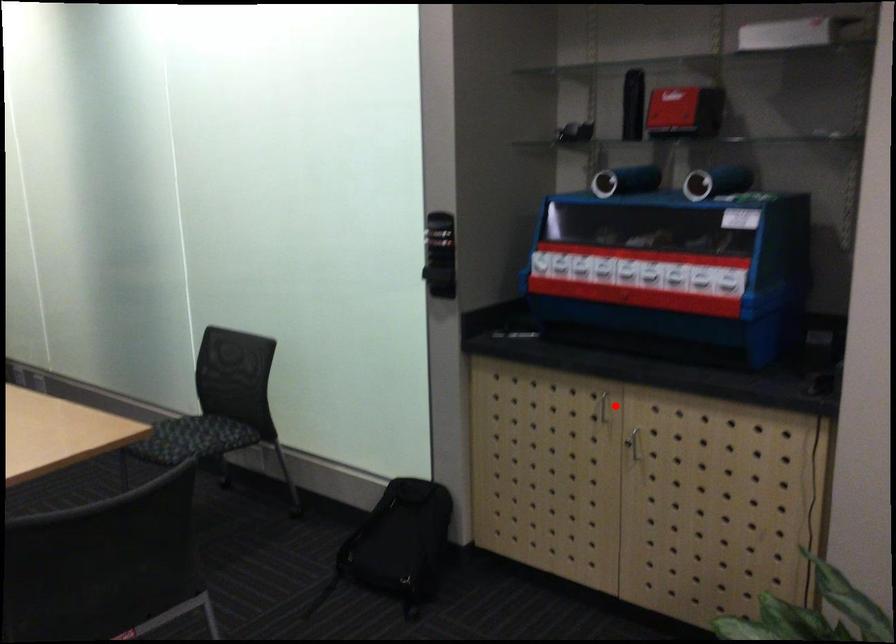
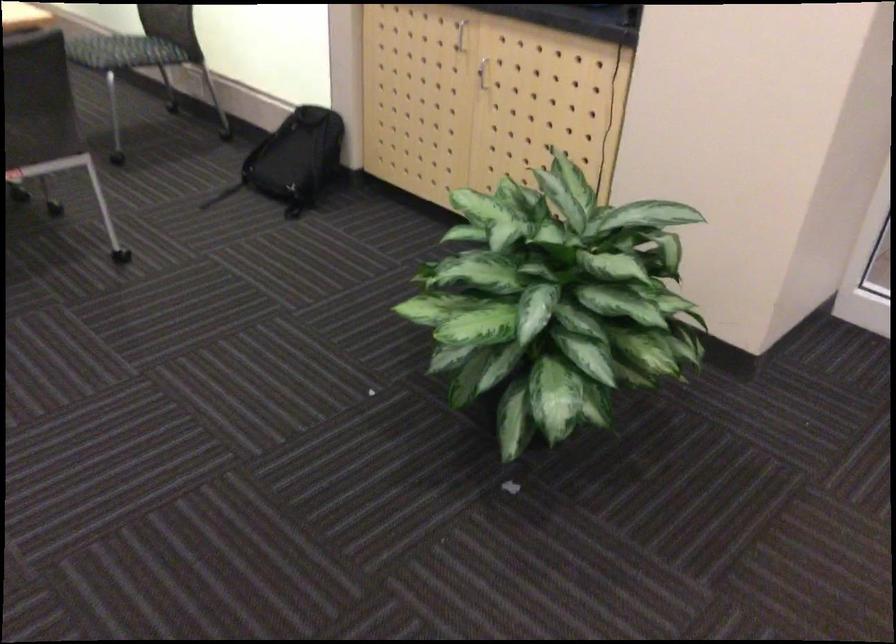
Locate, in the second image, the point that corresponds to the highlighted location in the first image.

(460, 35)